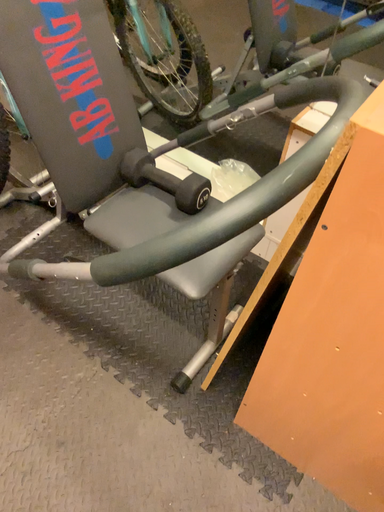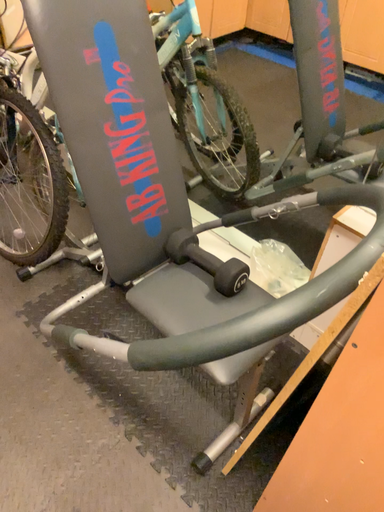
Question: How did the camera likely rotate when shooting the video?

Choices:
 (A) rotated upward
 (B) rotated downward

Answer: (A)